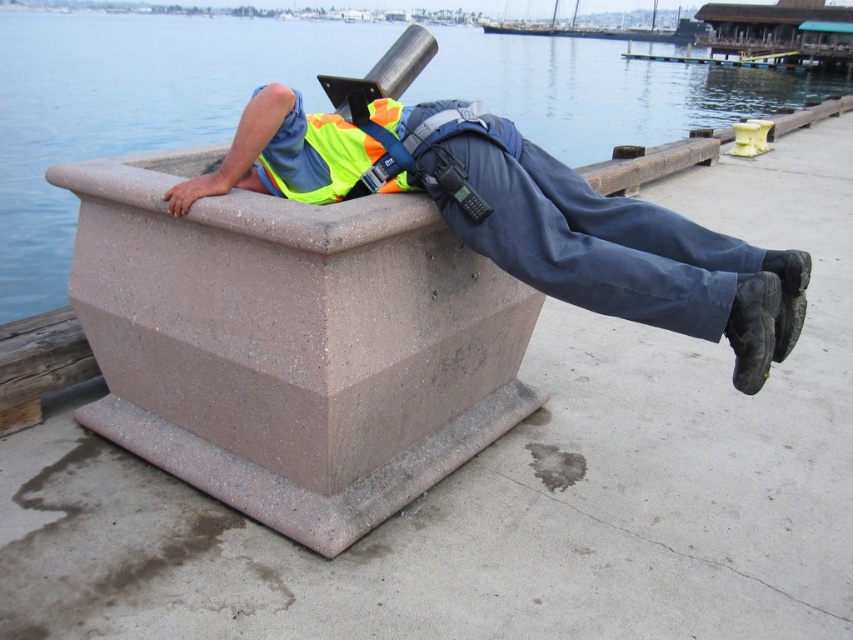
Is high-visibility yellow vest at upper center wider than high-visibility fabric safety vest at upper center?

Yes, high-visibility yellow vest at upper center is wider than high-visibility fabric safety vest at upper center.

Is point (218, 184) more distant than point (339, 124)?

No.

At what (x,y) coordinates should I click in order to perform the action: click on high-visibility yellow vest at upper center. Please return your answer as a coordinate pair (x, y). The width and height of the screenshot is (853, 640). Looking at the image, I should click on (525, 218).

Where is `high-visibility yellow vest at upper center`? This screenshot has width=853, height=640. high-visibility yellow vest at upper center is located at coordinates (525, 218).